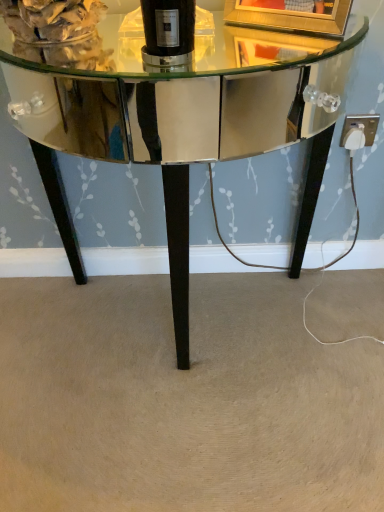
Question: Is white plastic outlet at lower right shorter than shiny mirrored table at center?

Choices:
 (A) yes
 (B) no

Answer: (A)

Question: Can you see white plastic outlet at lower right touching shiny mirrored table at center?

Choices:
 (A) no
 (B) yes

Answer: (A)

Question: Considering the relative sizes of white plastic outlet at lower right and shiny mirrored table at center in the image provided, is white plastic outlet at lower right wider than shiny mirrored table at center?

Choices:
 (A) yes
 (B) no

Answer: (B)

Question: Does white plastic outlet at lower right turn towards shiny mirrored table at center?

Choices:
 (A) yes
 (B) no

Answer: (B)

Question: From a real-world perspective, does white plastic outlet at lower right sit lower than shiny mirrored table at center?

Choices:
 (A) yes
 (B) no

Answer: (B)

Question: Can you confirm if white plastic outlet at lower right is smaller than shiny mirrored table at center?

Choices:
 (A) no
 (B) yes

Answer: (B)

Question: Does gold metallic picture frame at upper center turn towards shiny mirrored table at center?

Choices:
 (A) yes
 (B) no

Answer: (B)

Question: From a real-world perspective, does gold metallic picture frame at upper center sit lower than shiny mirrored table at center?

Choices:
 (A) no
 (B) yes

Answer: (A)

Question: From the image's perspective, is gold metallic picture frame at upper center above shiny mirrored table at center?

Choices:
 (A) yes
 (B) no

Answer: (A)

Question: Considering the relative sizes of gold metallic picture frame at upper center and shiny mirrored table at center in the image provided, is gold metallic picture frame at upper center shorter than shiny mirrored table at center?

Choices:
 (A) no
 (B) yes

Answer: (B)

Question: Does gold metallic picture frame at upper center have a larger size compared to shiny mirrored table at center?

Choices:
 (A) no
 (B) yes

Answer: (A)

Question: Does gold metallic picture frame at upper center have a smaller size compared to shiny mirrored table at center?

Choices:
 (A) no
 (B) yes

Answer: (B)

Question: Are shiny mirrored table at center and black glass bottle at center far apart?

Choices:
 (A) yes
 (B) no

Answer: (B)